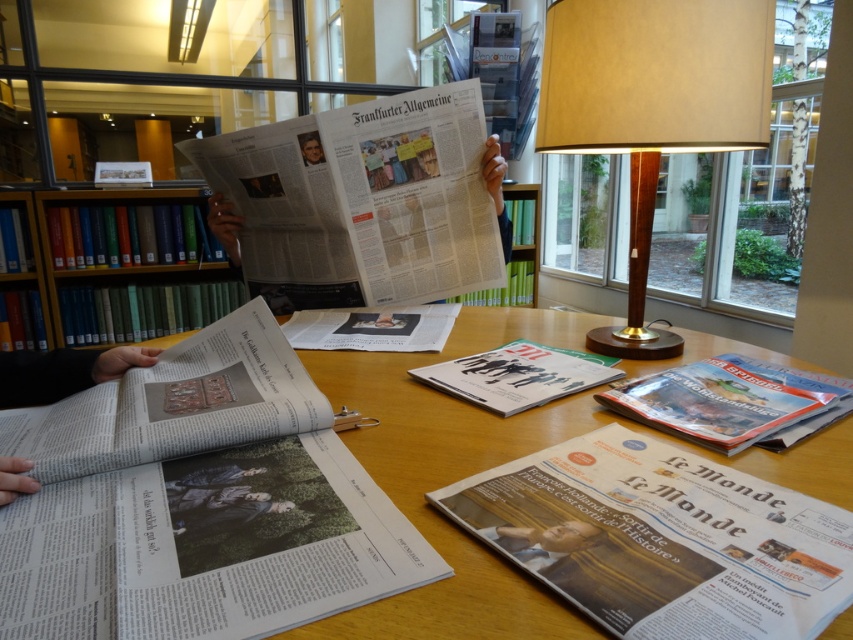
Where is `green matte bookshelf at upper left`? This screenshot has width=853, height=640. green matte bookshelf at upper left is located at coordinates (132, 275).

Is point (102, 196) positioned after point (471, 385)?

Yes.

In order to click on green matte bookshelf at upper left in this screenshot , I will do `click(132, 275)`.

Does white paper newspaper at center appear on the left side of green matte bookshelf at upper left?

In fact, white paper newspaper at center is to the right of green matte bookshelf at upper left.

Who is positioned more to the right, white paper newspaper at center or green matte bookshelf at upper left?

From the viewer's perspective, white paper newspaper at center appears more on the right side.

Locate an element on the screen. The height and width of the screenshot is (640, 853). white paper newspaper at center is located at coordinates (363, 202).

Is white paper newspaper at center in front of white paper at center?

That is False.

Where is `white paper newspaper at center`? This screenshot has height=640, width=853. white paper newspaper at center is located at coordinates (363, 202).

Where is `white paper newspaper at center`? This screenshot has width=853, height=640. white paper newspaper at center is located at coordinates (363, 202).